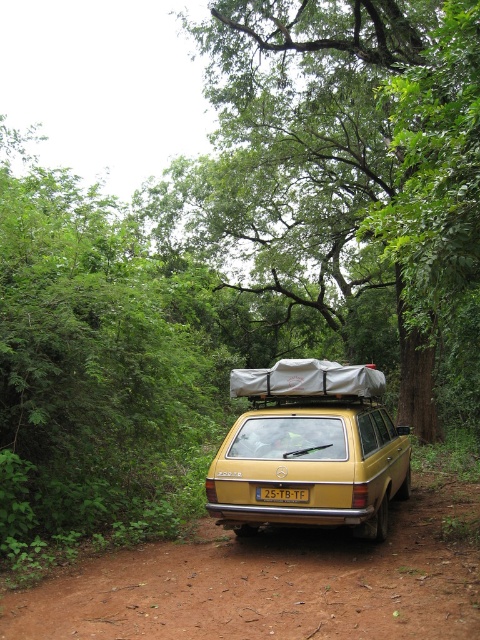
Question: Is green leafy tree at center smaller than gold matte station wagon at center?

Choices:
 (A) yes
 (B) no

Answer: (B)

Question: Does brown dirt track at lower center appear on the left side of gold matte station wagon at center?

Choices:
 (A) yes
 (B) no

Answer: (A)

Question: Which object is closer to the camera taking this photo?

Choices:
 (A) gold matte station wagon at center
 (B) brown dirt track at lower center

Answer: (B)

Question: Can you confirm if green leafy tree at center is bigger than black plastic license plate at rear?

Choices:
 (A) yes
 (B) no

Answer: (A)

Question: Which of these objects is positioned farthest from the brown dirt track at lower center?

Choices:
 (A) black plastic license plate at rear
 (B) gold matte station wagon at center

Answer: (B)

Question: Which point is farther to the camera?

Choices:
 (A) black plastic license plate at rear
 (B) green leafy tree at center
 (C) gold matte station wagon at center
 (D) brown dirt track at lower center

Answer: (A)